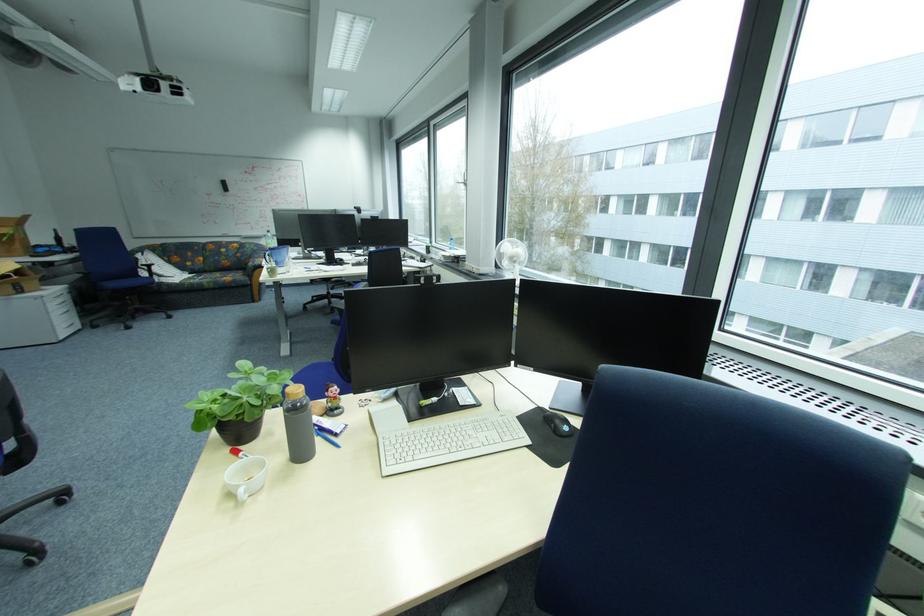
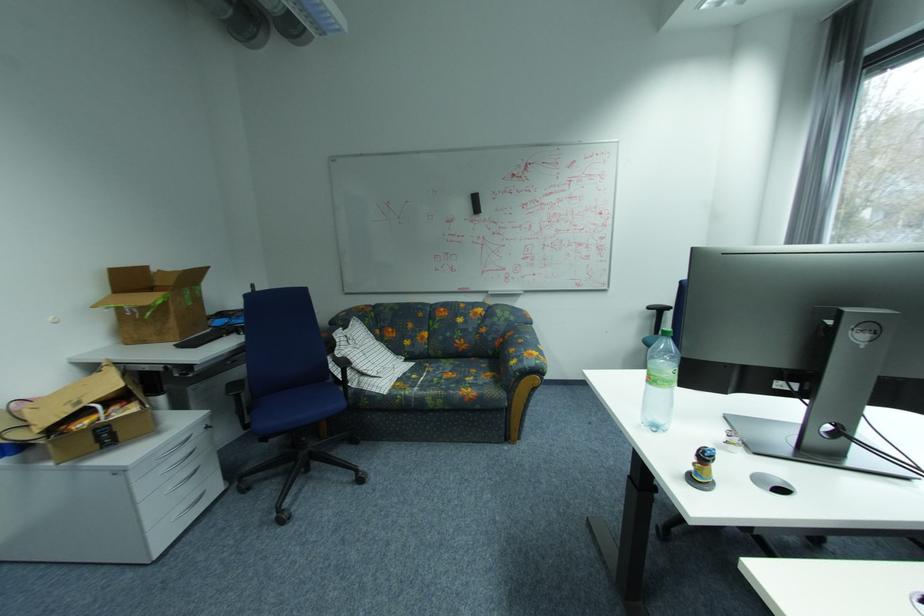
Locate, in the second image, the point that corresponds to point 228,187 in the first image.

(476, 206)